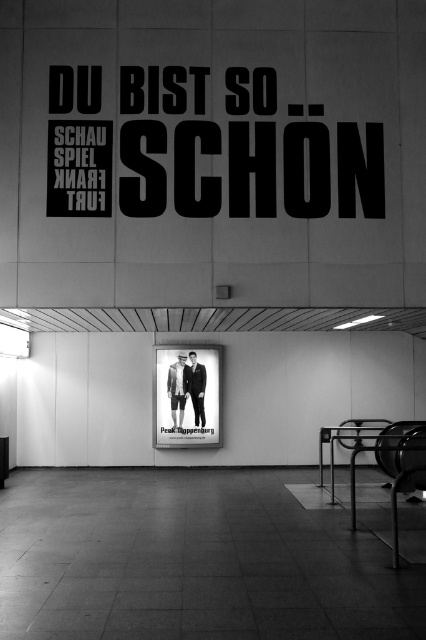
Can you confirm if matte black poster at center is positioned to the left of dark gray suit at center?

Correct, you'll find matte black poster at center to the left of dark gray suit at center.

Is matte black poster at center positioned before dark gray suit at center?

Yes.

Is point (215, 403) positioned before point (206, 380)?

Yes.

At what (x,y) coordinates should I click in order to perform the action: click on matte black poster at center. Please return your answer as a coordinate pair (x, y). This screenshot has width=426, height=640. Looking at the image, I should click on (187, 396).

Does white cotton shirt at center have a lesser width compared to dark gray suit at center?

No.

Does point (172, 388) lie in front of point (190, 394)?

That is True.

Image resolution: width=426 pixels, height=640 pixels. Identify the location of white cotton shirt at center. (178, 388).

Where is `white cotton shirt at center`? white cotton shirt at center is located at coordinates (178, 388).

Is matte black poster at center shorter than white cotton shirt at center?

In fact, matte black poster at center may be taller than white cotton shirt at center.

Can you confirm if matte black poster at center is positioned above white cotton shirt at center?

Actually, matte black poster at center is below white cotton shirt at center.

Where is `matte black poster at center`? matte black poster at center is located at coordinates (187, 396).

At what (x,y) coordinates should I click in order to perform the action: click on matte black poster at center. Please return your answer as a coordinate pair (x, y). Looking at the image, I should click on (187, 396).